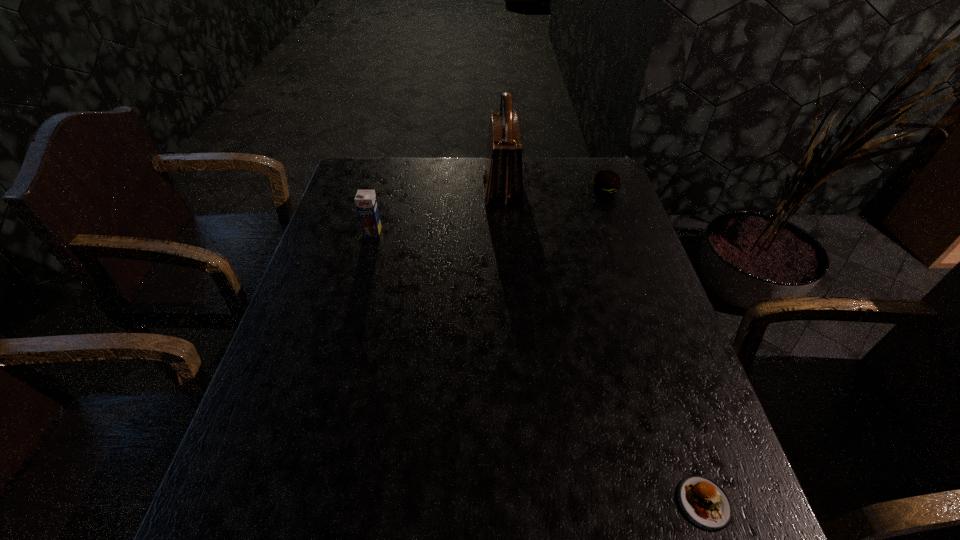
At what (x,y) coordinates should I click in order to perform the action: click on vacant space located 0.100m on the front flap of the tallest object. Please return your answer as a coordinate pair (x, y). Looking at the image, I should click on (452, 188).

This screenshot has width=960, height=540. I want to click on vacant space located 0.060m on the front label of the second tallest object, so click(x=368, y=251).

Locate an element on the screen. The image size is (960, 540). free point located on the left of the taller patty (food) is located at coordinates (545, 192).

Locate an element on the screen. This screenshot has width=960, height=540. vacant space located 0.100m on the left of the nearer patty (food) is located at coordinates (621, 503).

Identify the location of shoulder bag present at the far edge. (503, 180).

The height and width of the screenshot is (540, 960). Find the location of `patty positioned at the far edge`. patty positioned at the far edge is located at coordinates (606, 183).

Identify the location of object that is at the near edge. coord(705,503).

Find the location of a particular element. object located at the left edge is located at coordinates (366, 203).

What are the coordinates of `object located in the far right corner section of the desktop` in the screenshot? It's located at (606, 183).

Find the location of `object at the near right corner`. object at the near right corner is located at coordinates (705, 503).